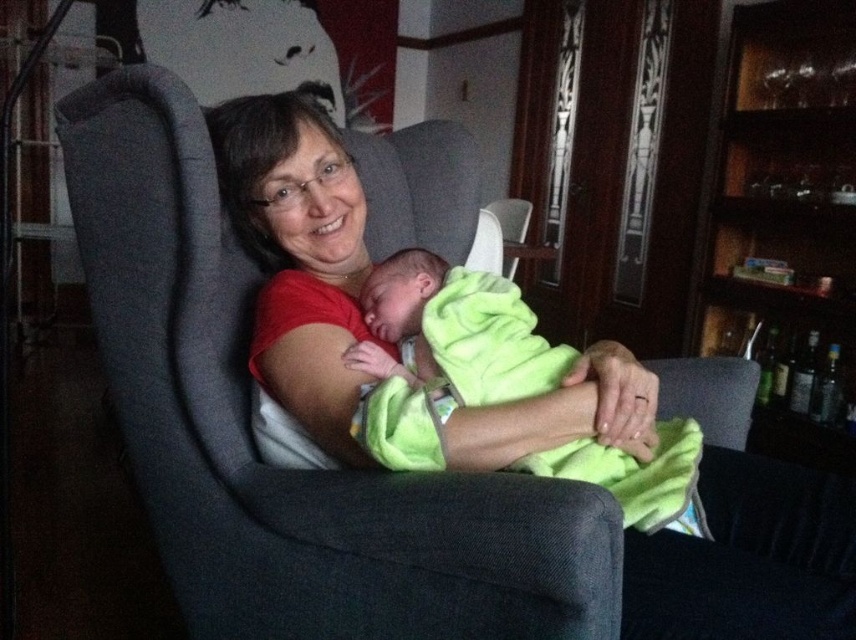
You are a photographer trying to capture a closeup of the matte red shirt at center and the soft green blanket at center. Since you want to focus on one object, which one should you choose to ensure it fills the frame more naturally without cropping?

The matte red shirt at center has a larger size compared to the soft green blanket at center, so you should choose the matte red shirt at center to fill the frame more naturally without cropping.

You are an interior designer planning to place a new lamp in the room. The lamp has a base that requires a clear space of 15 cm in diameter. Considering the position of the matte red shirt at center, can you confirm if there is enough space near it for the lamp?

The matte red shirt at center is located at point (299,256). Since the lamp requires a clear space of 15 cm in diameter, you need to ensure there is enough space around that coordinate. However, without knowing the exact dimensions of the room or the distance from other objects, it is difficult to confirm if the space is sufficient. Please provide more details about the room layout or object distances for an accurate assessment.

Based on the photo, you are a photographer setting up a shoot in this room. You want to position a light source to the left of the soft green blanket at center so that it illuminates the matte red shirt at center. Is the light source placement feasible based on their positions?

The matte red shirt at center is to the right of the soft green blanket at center. Placing the light source to the left of the soft green blanket at center would mean the light is on the opposite side of the matte red shirt at center, so it might not effectively illuminate the matte red shirt at center unless the light has a wide spread.